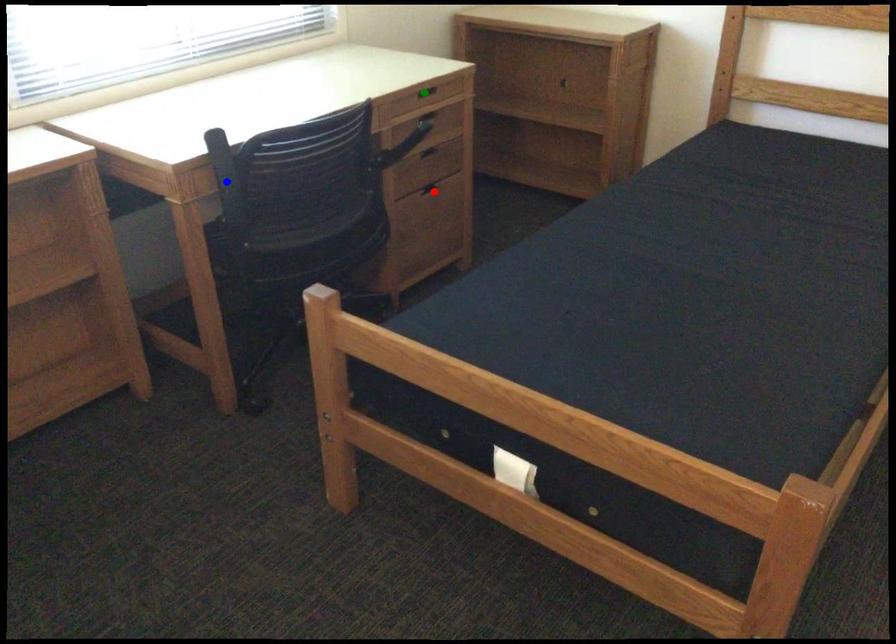
Order these from nearest to farthest:
blue point, red point, green point

blue point < green point < red point